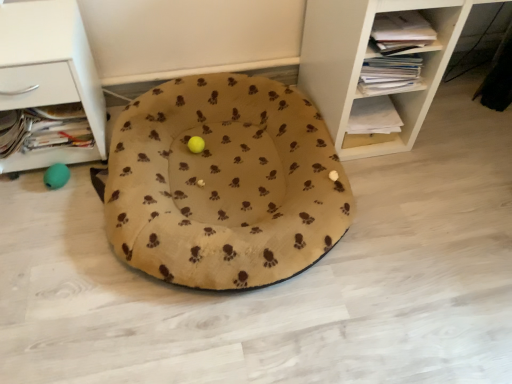
Question: From the image's perspective, relative to white wood shelf at upper right, which ranks as the second shelf in left-to-right order, is white matte drawer at left, which is counted as the 1th shelf, starting from the left, above or below?

Choices:
 (A) above
 (B) below

Answer: (B)

Question: Choose the correct answer: Is white matte drawer at left, positioned as the 2th shelf in right-to-left order, inside white wood shelf at upper right, which is counted as the 1th shelf, starting from the right, or outside it?

Choices:
 (A) inside
 (B) outside

Answer: (B)

Question: Which object is positioned farthest from the white wood shelf at upper right, which is counted as the 1th shelf, starting from the right?

Choices:
 (A) white matte drawer at left, which is counted as the 1th shelf, starting from the left
 (B) beige fleece dog bed at center

Answer: (A)

Question: Estimate the real-world distances between objects in this image. Which object is farther from the white wood shelf at upper right, which ranks as the second shelf in left-to-right order?

Choices:
 (A) beige fleece dog bed at center
 (B) white matte drawer at left, positioned as the 2th shelf in right-to-left order

Answer: (B)